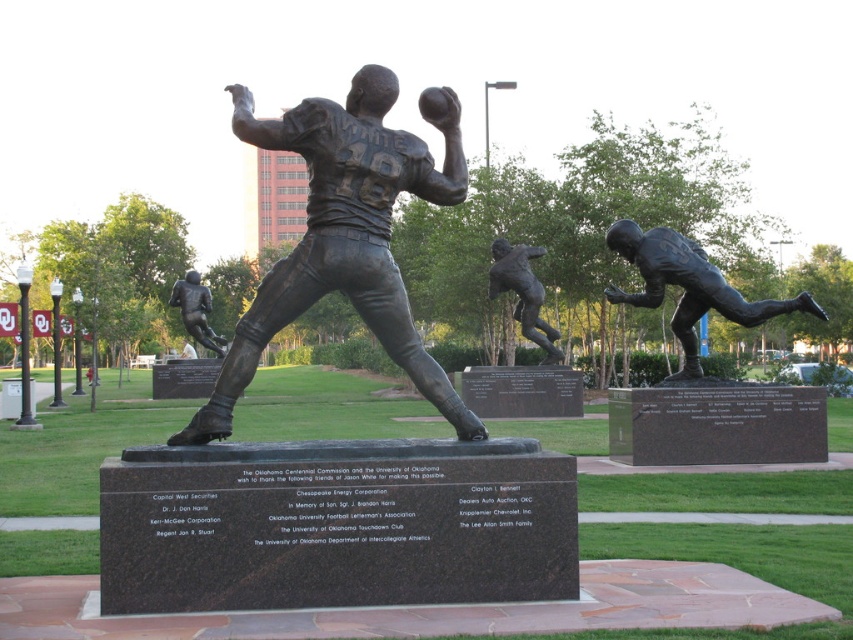
You are a tour guide explaining the layout of the sculpture garden. When pointing to the bronze statue at right and the bronze statue at center, which one is closer to the visitors standing at the entrance?

The bronze statue at right is closer to the visitors because it is positioned in front of the bronze statue at center.